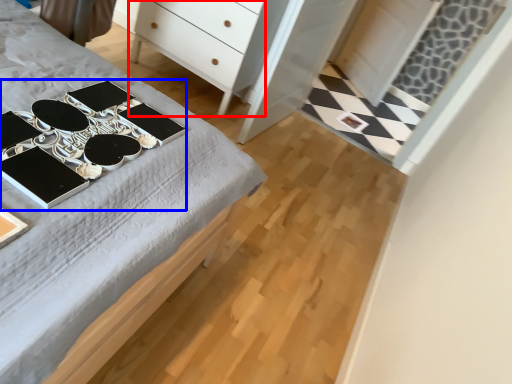
Question: Which object is closer to the camera taking this photo, chest of drawers (highlighted by a red box) or changing table (highlighted by a blue box)?

Choices:
 (A) chest of drawers
 (B) changing table

Answer: (B)